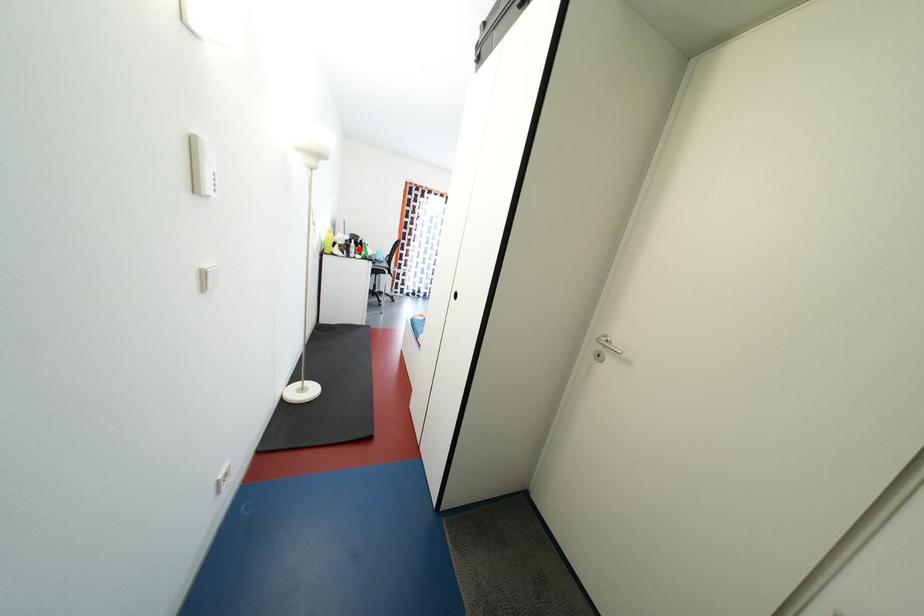
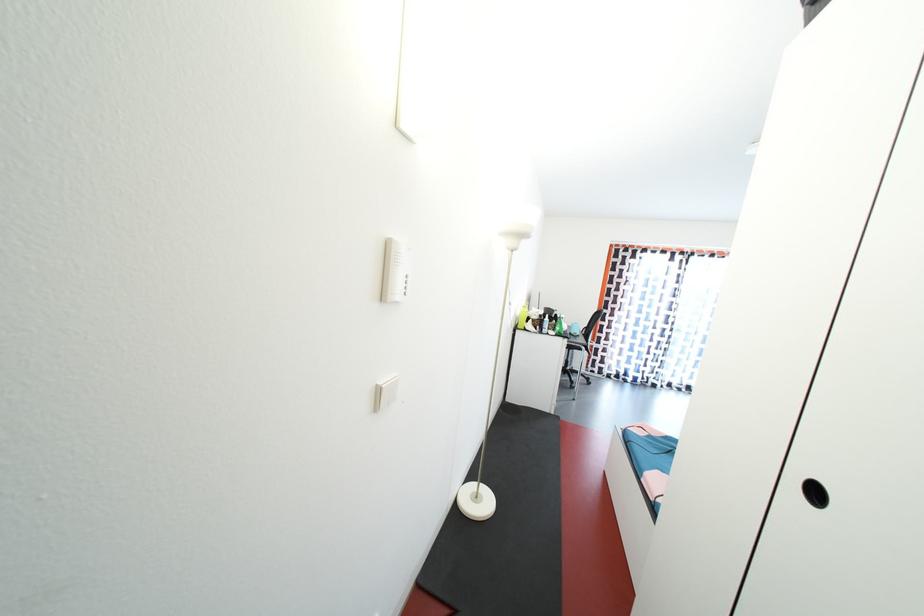
Question: I am providing you with two images of the same scene from different viewpoints. Image1 has a red point marked. In image2, the corresponding 3D location appears at what relative position? Reply with the corresponding letter.

Choices:
 (A) Closer
 (B) Farther

Answer: (B)